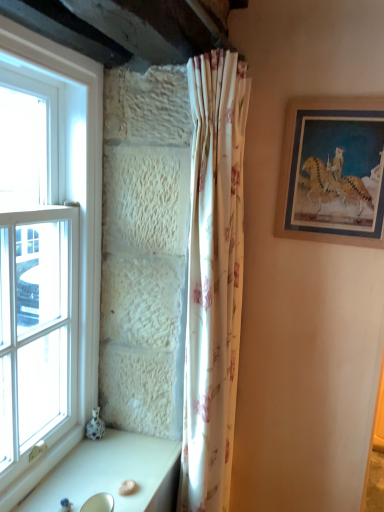
Where is `blank space situated above white glossy table at lower left (from a real-world perspective)`? The height and width of the screenshot is (512, 384). blank space situated above white glossy table at lower left (from a real-world perspective) is located at coordinates (102, 470).